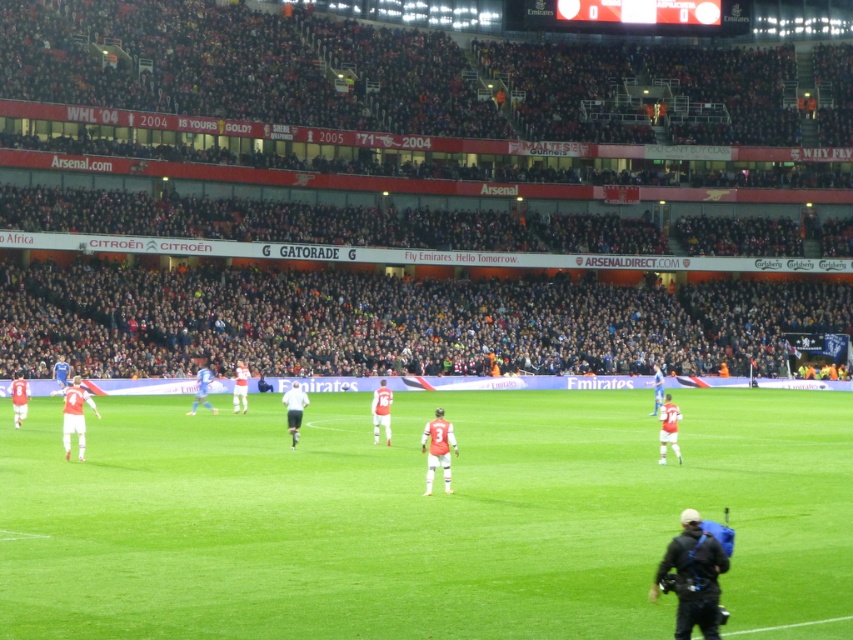
You are a drone operator trying to capture aerial footage of the soccer match. You need to ensure the camera focuses on the green grass field at center and the dark gray crowd at center. Based on their positions, which object will appear closer to the bottom of the camera frame?

The green grass field at center is located below the dark gray crowd at center, so the green grass field at center will appear closer to the bottom of the camera frame.

You are a photographer standing at the point marked as point (299,572). You want to capture a wide shot of the entire soccer field. Considering the distance between you and the point, will you be able to fit the entire field into your camera frame if your camera has a 50mm lens?

The distance between you and the point is 16.21 meters. With a 50mm lens, the field of view is approximately 27 degrees. To determine if the entire field fits, calculate the angle of the field relative to your position. If the field is within 27 degrees, it will fit. However, without knowing the field dimensions, it is impossible to confirm. The answer requires additional information about the field size.